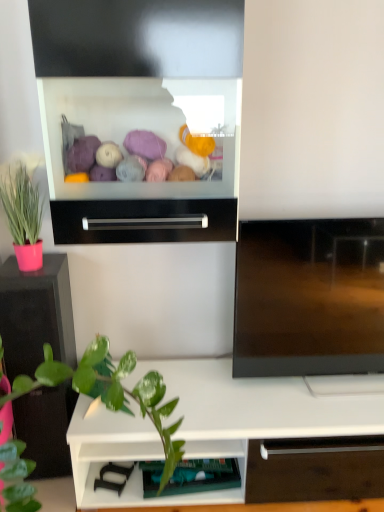
Find the location of a particular element. This screenshot has height=512, width=384. blank space above teal fabric drawer at lower center, which is counted as the 1th shelf, starting from the left (from a real-world perspective) is located at coordinates (198, 466).